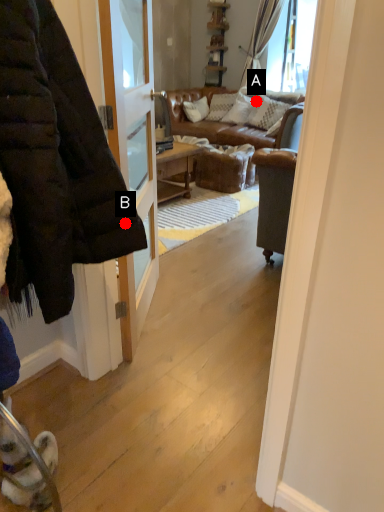
Question: Two points are circled on the image, labeled by A and B beside each circle. Which point is closer to the camera taking this photo?

Choices:
 (A) A is closer
 (B) B is closer

Answer: (B)